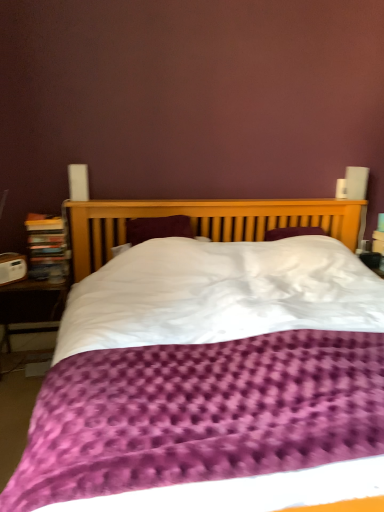
Image resolution: width=384 pixels, height=512 pixels. What do you see at coordinates (207, 220) in the screenshot? I see `purple textured duvet at center` at bounding box center [207, 220].

You are a GUI agent. You are given a task and a screenshot of the screen. Output one action in this format:
    pyautogui.click(x=<x>, y=<y>)
    Task: Click on the purple textured duvet at center
    This screenshot has height=512, width=384.
    Given the screenshot: What is the action you would take?
    pyautogui.click(x=207, y=220)

The height and width of the screenshot is (512, 384). Identify the location of wooden bookcase at left. (47, 248).

From their relative heights in the image, would you say wooden bookcase at left is taller or shorter than purple textured duvet at center?

wooden bookcase at left is shorter than purple textured duvet at center.

Is wooden bookcase at left looking in the opposite direction of purple textured duvet at center?

That's not correct — wooden bookcase at left is not looking away from purple textured duvet at center.

From a real-world perspective, who is located lower, wooden bookcase at left or purple textured duvet at center?

purple textured duvet at center.

Looking at this image, can you confirm if wooden bookcase at left is positioned to the right of purple textured duvet at center?

Incorrect, wooden bookcase at left is not on the right side of purple textured duvet at center.

Is purple textured duvet at center bigger or smaller than wooden bookcase at left?

purple textured duvet at center is bigger than wooden bookcase at left.

Can you confirm if purple textured duvet at center is positioned to the left of wooden bookcase at left?

In fact, purple textured duvet at center is to the right of wooden bookcase at left.

Looking at their sizes, would you say purple textured duvet at center is wider or thinner than wooden bookcase at left?

purple textured duvet at center is wider than wooden bookcase at left.

Would you say wooden bookcase at left is part of purple textured duvet at center's contents?

Definitely not — wooden bookcase at left is not inside purple textured duvet at center.

Which object is positioned more to the left, purple textured duvet at center or wooden table at lower left?

From the viewer's perspective, wooden table at lower left appears more on the left side.

The height and width of the screenshot is (512, 384). What are the coordinates of `table that appears behind the purple textured duvet at center` in the screenshot? It's located at (31, 307).

Considering the sizes of objects purple textured duvet at center and wooden table at lower left in the image provided, who is taller, purple textured duvet at center or wooden table at lower left?

With more height is purple textured duvet at center.

Which is farther, (110, 244) or (8, 327)?

The point (8, 327) is farther.

Locate an element on the screen. table that is in front of the wooden bookcase at left is located at coordinates (31, 307).

Considering the relative sizes of wooden bookcase at left and wooden table at lower left in the image provided, is wooden bookcase at left taller than wooden table at lower left?

No.

From a real-world perspective, between wooden bookcase at left and wooden table at lower left, who is vertically higher?

In real-world perspective, wooden bookcase at left is above.

Does wooden table at lower left contain wooden bookcase at left?

No, wooden bookcase at left is not inside wooden table at lower left.

In the scene shown: Is wooden table at lower left in contact with wooden bookcase at left?

There is a gap between wooden table at lower left and wooden bookcase at left.

Between wooden table at lower left and wooden bookcase at left, which one has larger width?

With larger width is wooden table at lower left.

Would you consider wooden table at lower left to be distant from purple textured duvet at center?

No, there isn't a large distance between wooden table at lower left and purple textured duvet at center.

Between point (40, 294) and point (301, 223), which one is positioned behind?

The point (301, 223) is farther from the camera.

Measure the distance from wooden table at lower left to purple textured duvet at center.

wooden table at lower left is 22.75 inches from purple textured duvet at center.

Find the location of a particular element. bookcase on the left of purple textured duvet at center is located at coordinates (47, 248).

At what (x,y) coordinates should I click in order to perform the action: click on bed that appears in front of the wooden bookcase at left. Please return your answer as a coordinate pair (x, y). Image resolution: width=384 pixels, height=512 pixels. Looking at the image, I should click on (207, 220).

Based on their spatial positions, is purple textured duvet at center or wooden table at lower left closer to wooden bookcase at left?

wooden table at lower left is positioned closer to the anchor wooden bookcase at left.

From the image, which object appears to be nearer to purple textured duvet at center, wooden bookcase at left or wooden table at lower left?

wooden bookcase at left is closer to purple textured duvet at center.

Estimate the real-world distances between objects in this image. Which object is further from wooden table at lower left, wooden bookcase at left or purple textured duvet at center?

Among the two, purple textured duvet at center is located further to wooden table at lower left.

Looking at the image, which one is located further to wooden bookcase at left, wooden table at lower left or purple textured duvet at center?

purple textured duvet at center lies further to wooden bookcase at left than the other object.

From the image, which object appears to be farther from purple textured duvet at center, wooden table at lower left or wooden bookcase at left?

wooden table at lower left.

Considering their positions, is purple textured duvet at center positioned further to wooden table at lower left than wooden bookcase at left?

Among the two, purple textured duvet at center is located further to wooden table at lower left.

In order to click on table located between purple textured duvet at center and wooden bookcase at left in the depth direction in this screenshot , I will do `click(31, 307)`.